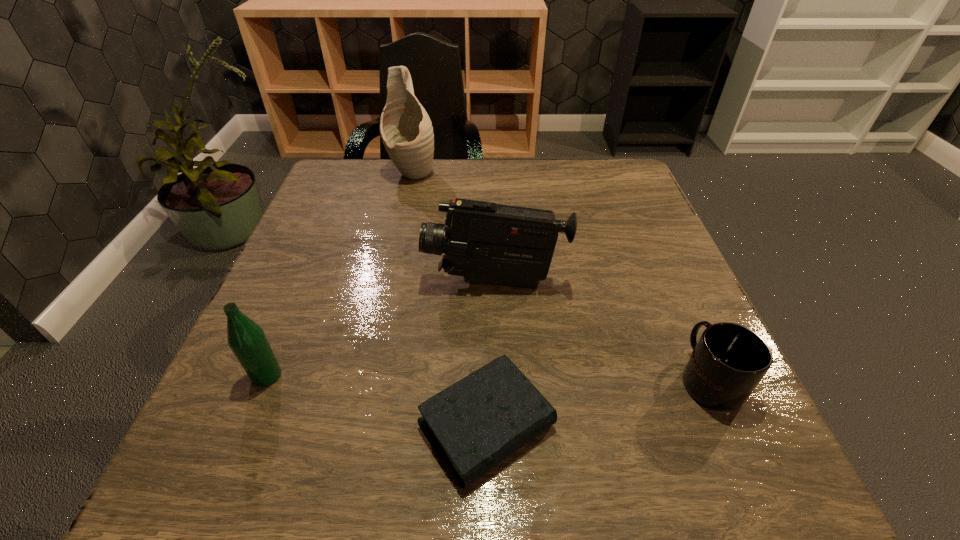
You are a GUI agent. You are given a task and a screenshot of the screen. Output one action in this format:
    pyautogui.click(x=<x>, y=<y>)
    Task: Click on the pitcher
    
    Given the screenshot: What is the action you would take?
    pyautogui.click(x=406, y=130)

The image size is (960, 540). Identify the location of the tallest object. (406, 130).

The width and height of the screenshot is (960, 540). I want to click on the second farthest object, so click(487, 242).

Identify the location of bottle. The width and height of the screenshot is (960, 540). (247, 340).

This screenshot has width=960, height=540. In order to click on mug in this screenshot , I will do `click(729, 360)`.

Locate an element on the screen. The image size is (960, 540). the rightmost object is located at coordinates (729, 360).

The image size is (960, 540). Find the location of `Bible`. Bible is located at coordinates (476, 423).

Image resolution: width=960 pixels, height=540 pixels. Identify the location of free space located at the spout of the pitcher. (390, 274).

Find the location of a particular element. The height and width of the screenshot is (540, 960). vacant point located on the front-facing side of the fourth nearest object is located at coordinates (303, 282).

What are the coordinates of `vacant space situated 0.250m on the front-facing side of the fourth nearest object` in the screenshot? It's located at (298, 282).